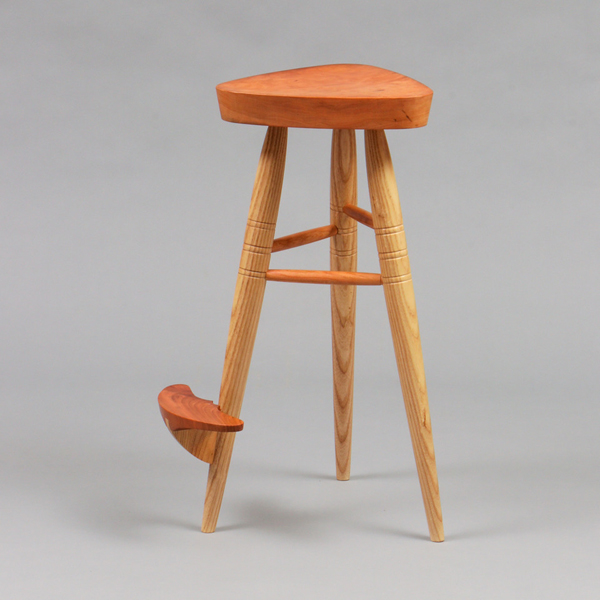
At what (x,y) coordinates should I click in order to perform the action: click on wood legs bottom. Please return your answer as a coordinate pair (x, y). Looking at the image, I should click on (x=350, y=192).